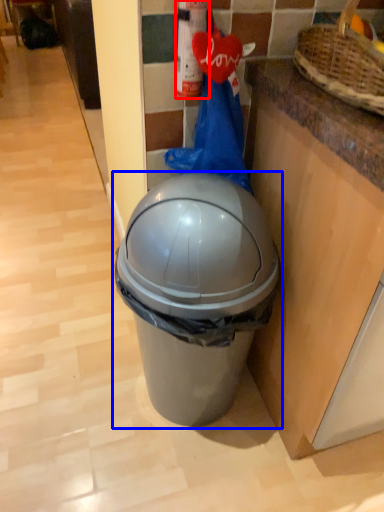
Question: Which of the following is the closest to the observer, extinguisher (highlighted by a red box) or waste container (highlighted by a blue box)?

Choices:
 (A) extinguisher
 (B) waste container

Answer: (B)